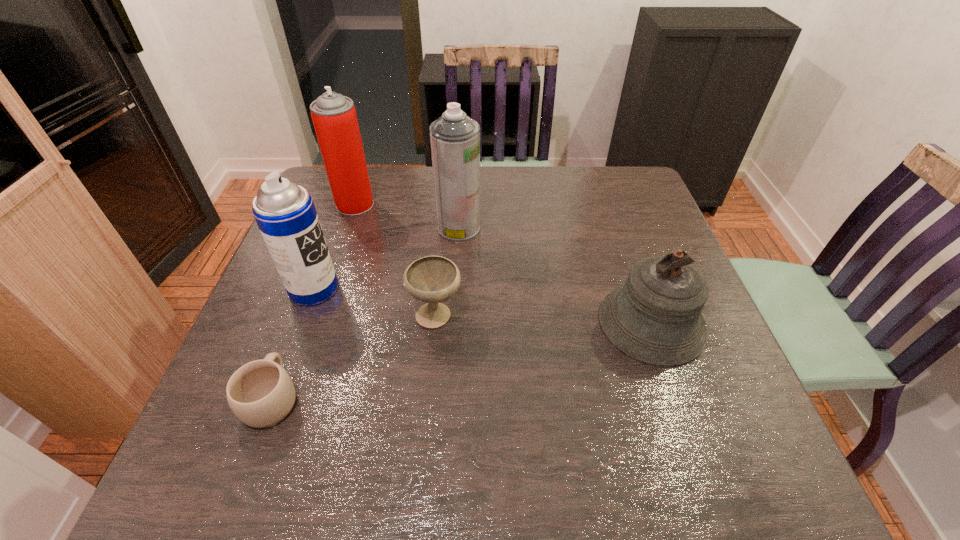
Identify the location of the rightmost aerosol can. (455, 138).

This screenshot has width=960, height=540. Identify the location of the nearest aerosol can. (285, 213).

Where is `the third shortest object`? This screenshot has width=960, height=540. the third shortest object is located at coordinates click(655, 318).

Identify the location of the rightmost object. This screenshot has width=960, height=540. (655, 318).

Image resolution: width=960 pixels, height=540 pixels. I want to click on the second shortest object, so click(x=432, y=279).

Find the location of `mug`. mug is located at coordinates (261, 394).

Locate an element on the screen. This screenshot has width=960, height=540. the shortest object is located at coordinates (261, 394).

Where is `vacant region located 0.320m on the front of the rightmost aerosol can`? vacant region located 0.320m on the front of the rightmost aerosol can is located at coordinates (453, 337).

At what (x,y) coordinates should I click in order to perform the action: click on vacant area situated on the label side of the nearest aerosol can. Please return your answer as a coordinate pair (x, y). The height and width of the screenshot is (540, 960). Looking at the image, I should click on (475, 289).

Identify the location of vacant point located on the left of the fourth tallest object. (452, 323).